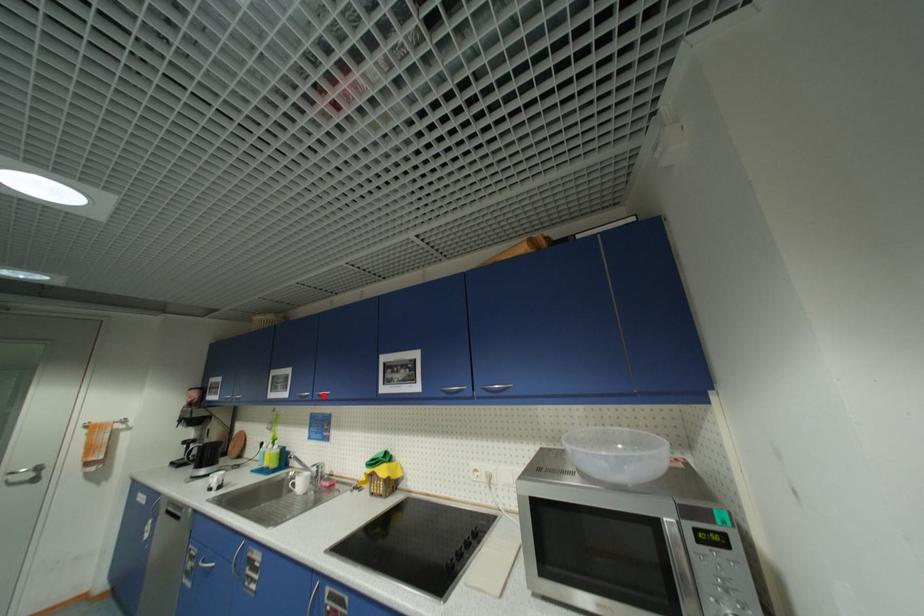
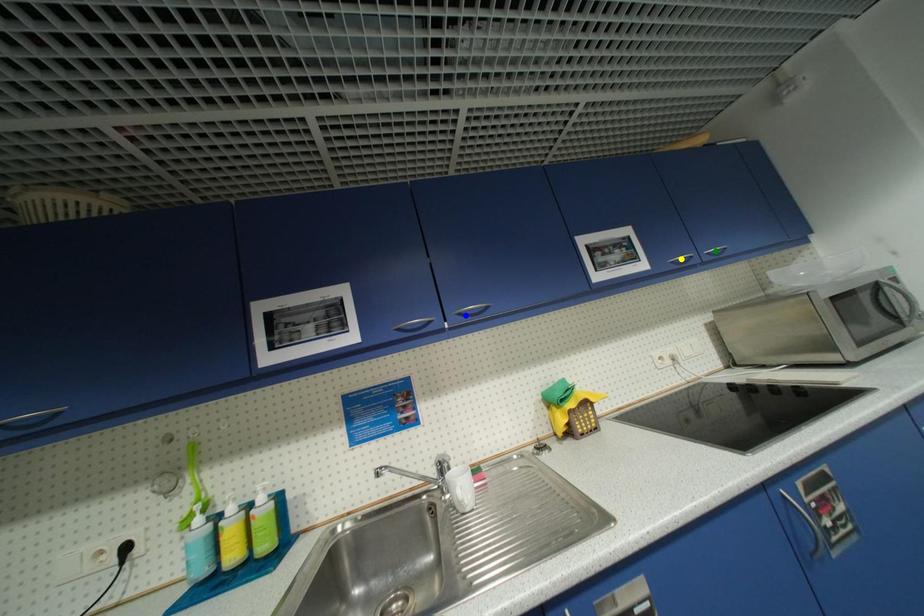
Question: I am providing you with two images of the same scene from different viewpoints. A red point is marked on the first image. You are given multiple points on the second image. Which point in image 2 is actually the same real-world point as the red point in image 1?

Choices:
 (A) blue point
 (B) green point
 (C) yellow point

Answer: (A)